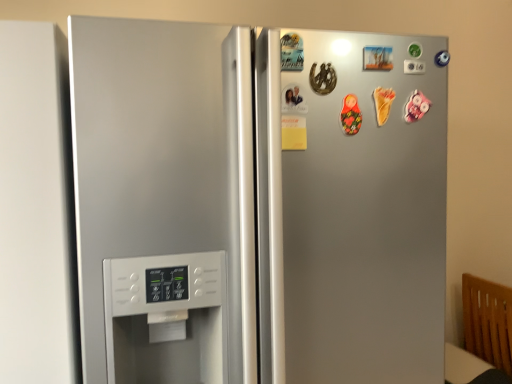
Question: From a real-world perspective, is white matte refrigerator door at left above or below satin silver refrigerator at center?

Choices:
 (A) below
 (B) above

Answer: (B)

Question: Is white matte refrigerator door at left wider or thinner than satin silver refrigerator at center?

Choices:
 (A) thin
 (B) wide

Answer: (A)

Question: Considering the positions of white matte refrigerator door at left and satin silver refrigerator at center in the image, is white matte refrigerator door at left taller or shorter than satin silver refrigerator at center?

Choices:
 (A) tall
 (B) short

Answer: (B)

Question: Considering the relative positions of satin silver refrigerator at center and white matte refrigerator door at left in the image provided, is satin silver refrigerator at center to the left or to the right of white matte refrigerator door at left?

Choices:
 (A) right
 (B) left

Answer: (A)

Question: From their relative heights in the image, would you say satin silver refrigerator at center is taller or shorter than white matte refrigerator door at left?

Choices:
 (A) tall
 (B) short

Answer: (A)

Question: Is point (387, 248) closer or farther from the camera than point (28, 354)?

Choices:
 (A) closer
 (B) farther

Answer: (B)

Question: From a real-world perspective, is satin silver refrigerator at center above or below white matte refrigerator door at left?

Choices:
 (A) above
 (B) below

Answer: (B)